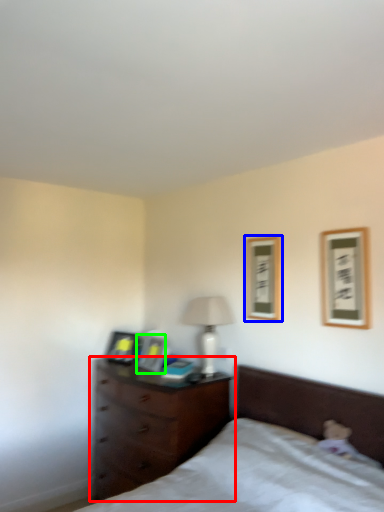
Question: Estimate the real-world distances between objects in this image. Which object is farther from chest of drawers (highlighted by a red box), picture frame (highlighted by a blue box) or picture frame (highlighted by a green box)?

Choices:
 (A) picture frame
 (B) picture frame

Answer: (A)